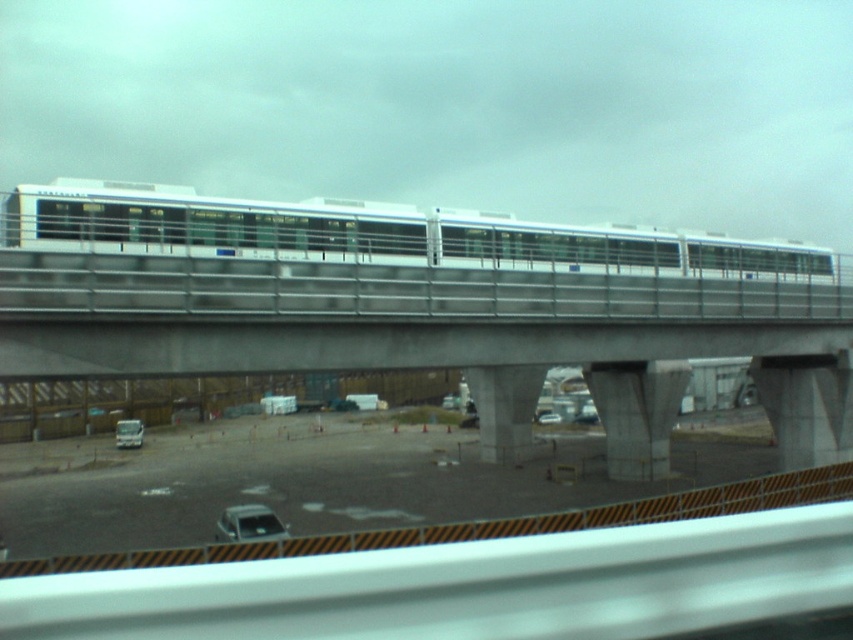
Who is lower down, silver metallic van at lower left or silver metallic car at center?

silver metallic van at lower left is lower down.

Does point (115, 429) come closer to viewer compared to point (550, 417)?

Yes, point (115, 429) is closer to viewer.

Locate an element on the screen. The height and width of the screenshot is (640, 853). silver metallic van at lower left is located at coordinates (128, 433).

Which is above, white glossy train at center or silver metallic van at lower left?

white glossy train at center is higher up.

Who is more forward, (x=544, y=266) or (x=136, y=442)?

Point (x=544, y=266)

What do you see at coordinates (375, 234) in the screenshot? Image resolution: width=853 pixels, height=640 pixels. I see `white glossy train at center` at bounding box center [375, 234].

The height and width of the screenshot is (640, 853). In order to click on white glossy train at center in this screenshot , I will do `click(375, 234)`.

Can you confirm if silver metallic car at lower center is positioned to the left of silver metallic car at center?

Yes, silver metallic car at lower center is to the left of silver metallic car at center.

Is silver metallic car at lower center smaller than silver metallic car at center?

No.

The height and width of the screenshot is (640, 853). What are the coordinates of `silver metallic car at lower center` in the screenshot? It's located at (248, 524).